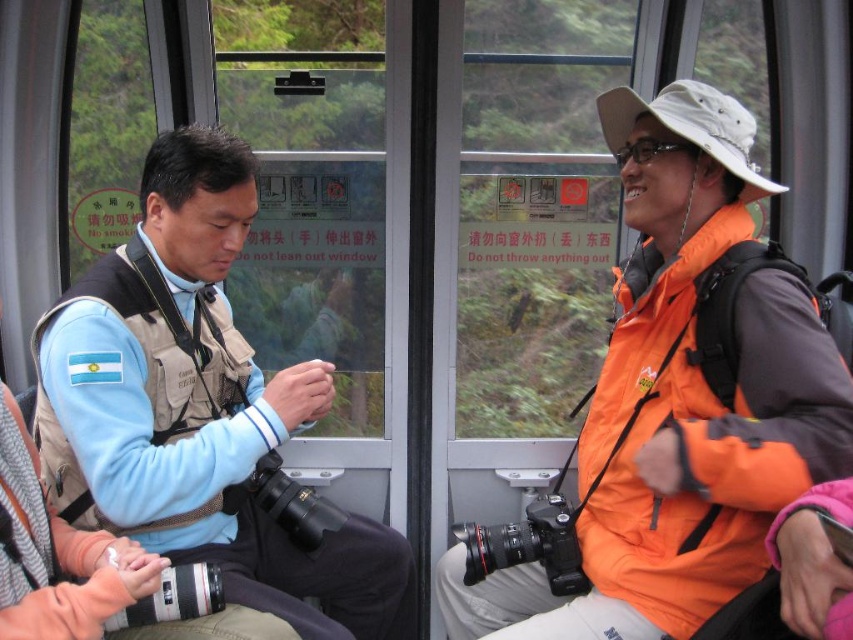
Question: Is orange matte jacket at right wider than light blue fabric jacket at left?

Choices:
 (A) no
 (B) yes

Answer: (A)

Question: Does orange matte jacket at right appear over light blue fabric jacket at left?

Choices:
 (A) yes
 (B) no

Answer: (A)

Question: Is orange matte jacket at right smaller than light blue fabric jacket at left?

Choices:
 (A) no
 (B) yes

Answer: (B)

Question: Which of the following is the farthest from the observer?

Choices:
 (A) orange matte jacket at right
 (B) light blue fabric jacket at left

Answer: (B)